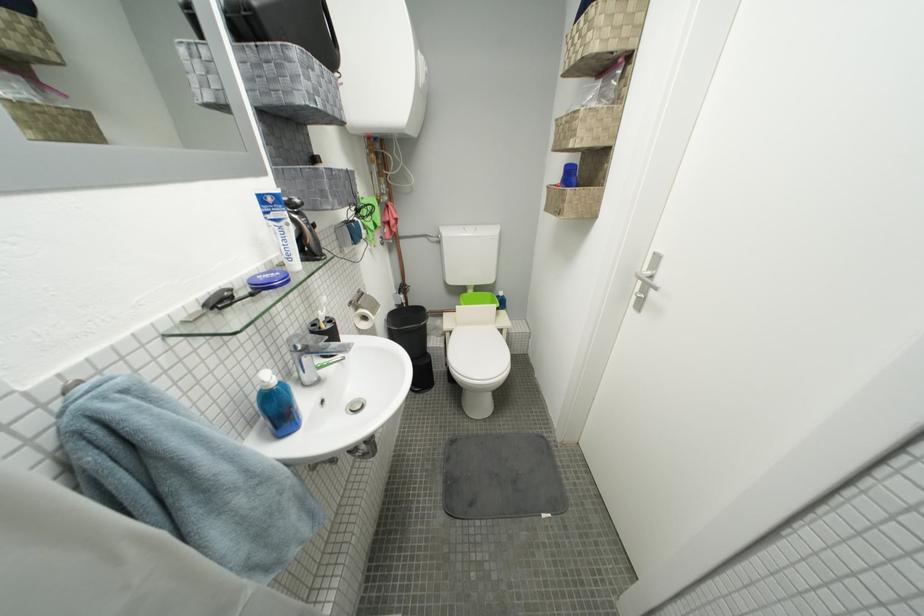
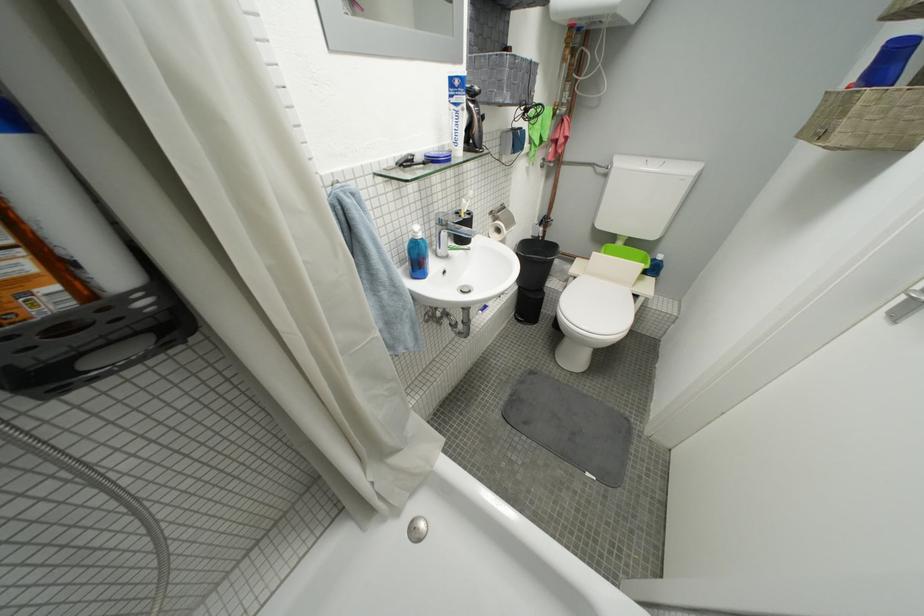
Locate, in the second image, the point that corresponds to (x=459, y=334) in the first image.

(584, 281)